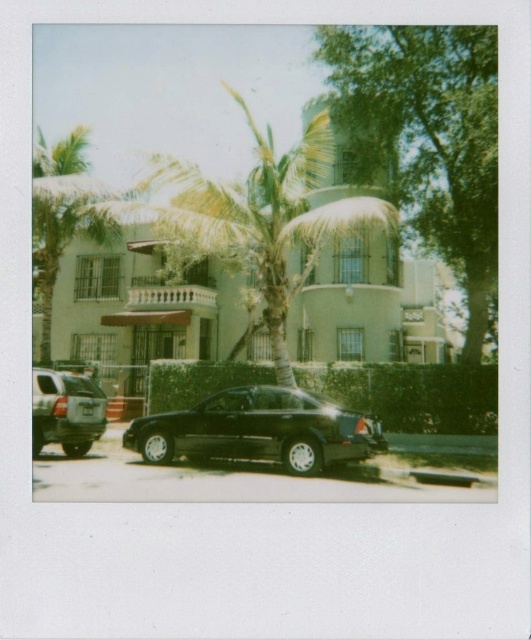
You are standing on the sidewalk in front of the beige stucco building at center and want to take a photo of the green leafy tree at upper right. Will the building block your view of the tree?

The beige stucco building at center is in front of the green leafy tree at upper right, so the building will block your view of the tree.

You are standing in front of the building and want to take a photo that includes both the palm tree and the dark colored sedan. The palm tree is at point (365, 429) and the sedan is at point (33, 435). Which point should you focus on to ensure both are in sharp focus?

You should focus on point (365, 429) because it is closer to the camera than point (33, 435). This ensures the palm tree is in focus, and the sedan at the farther point will also be within the depth of field.